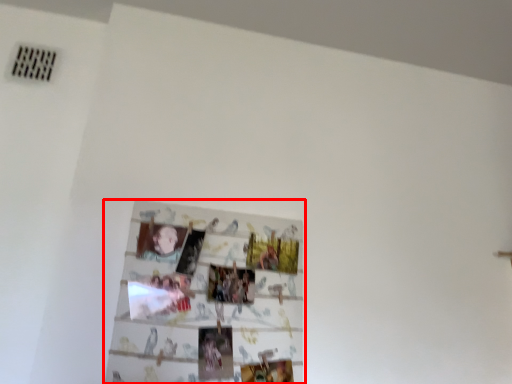
Question: From the image's perspective, what is the correct spatial relationship of picture frame (annotated by the red box) in relation to person?

Choices:
 (A) below
 (B) above

Answer: (A)